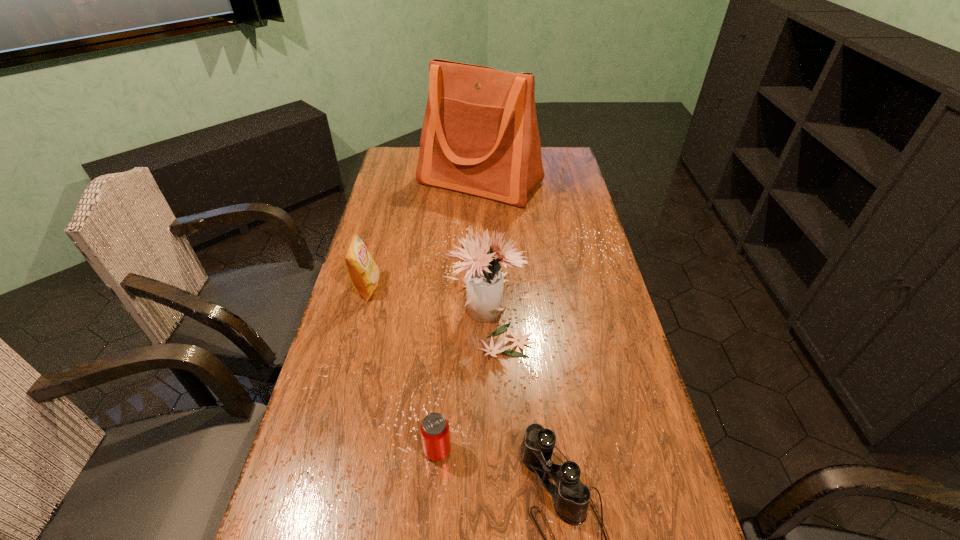
Find the location of a particular element. The height and width of the screenshot is (540, 960). the tallest object is located at coordinates (480, 136).

This screenshot has width=960, height=540. What are the coordinates of `shopping bag` in the screenshot? It's located at (480, 136).

Find the location of a particular element. the second tallest object is located at coordinates (484, 282).

Where is `the leftmost object`? The image size is (960, 540). the leftmost object is located at coordinates (362, 270).

I want to click on the third shortest object, so click(x=362, y=270).

What are the coordinates of `can` in the screenshot? It's located at (435, 433).

At what (x,y) coordinates should I click in order to perform the action: click on vacant space situated on the front of the farthest object. Please return your answer as a coordinate pair (x, y). This screenshot has height=540, width=960. Looking at the image, I should click on (480, 270).

Locate an element on the screen. free space located on the left of the bouquet is located at coordinates (386, 310).

Find the location of a particular element. The image size is (960, 540). vacant region located on the front-facing side of the leftmost object is located at coordinates (506, 287).

Locate an element on the screen. This screenshot has width=960, height=540. vacant space located 0.140m on the right of the can is located at coordinates (515, 450).